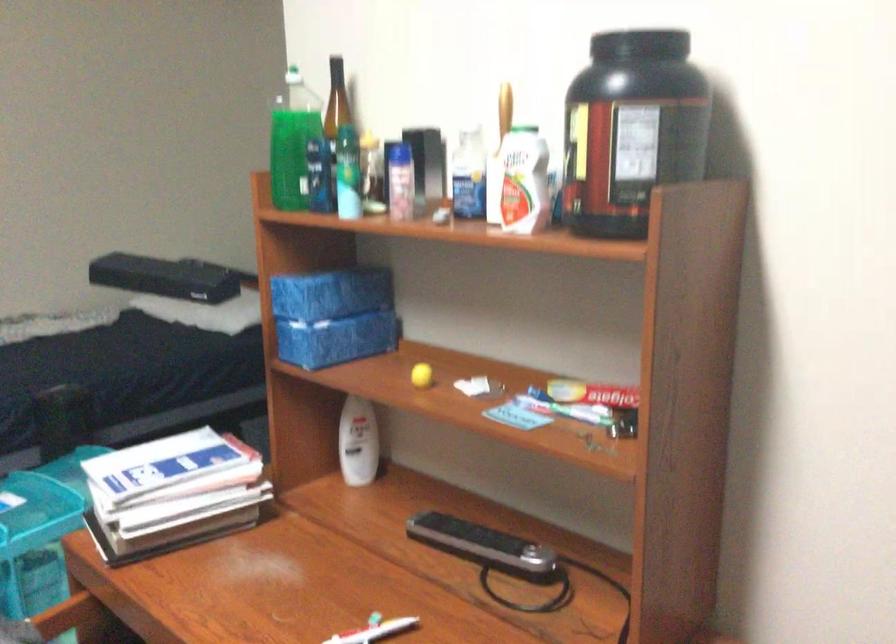
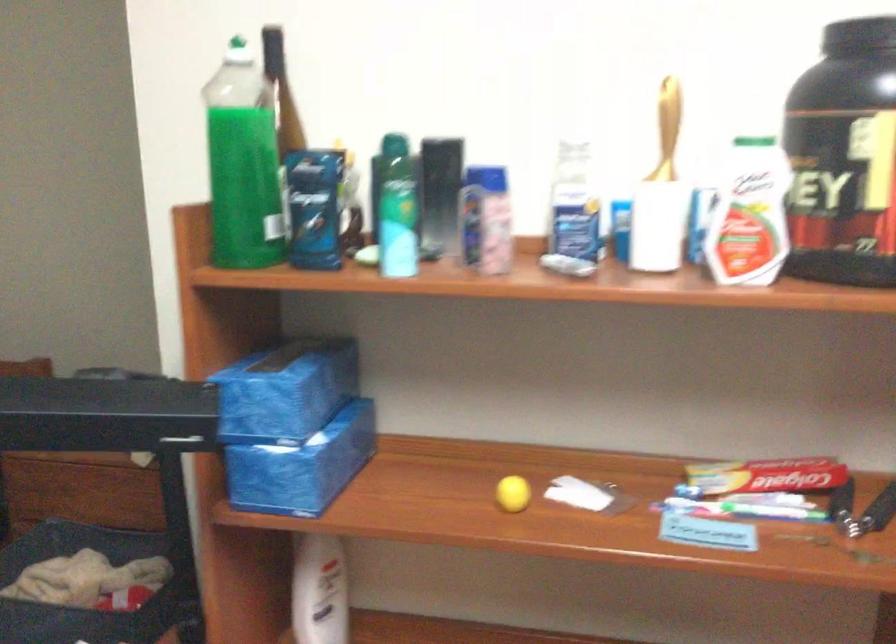
Where in the second image is the point corresponding to (x=298, y=343) from the first image?

(288, 478)